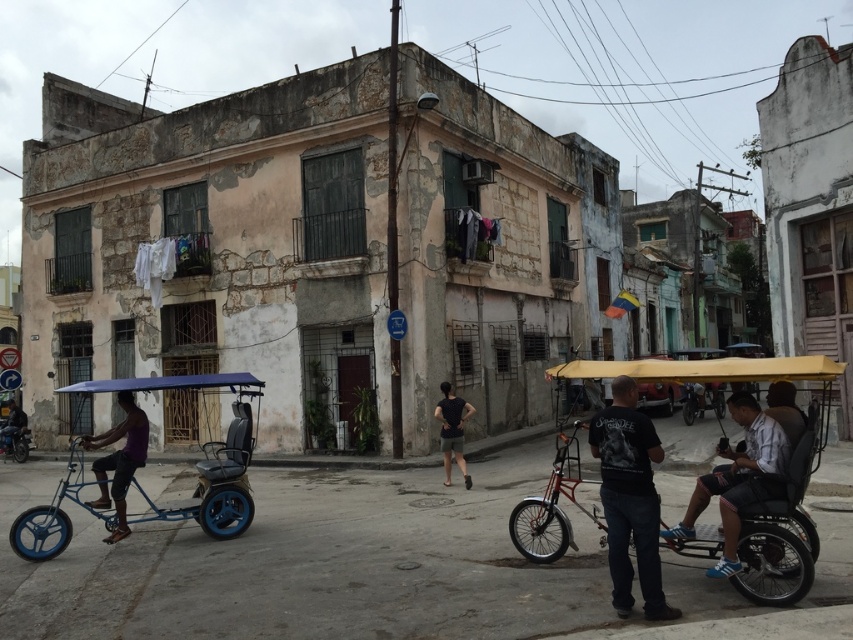
You are standing at the center of the street and see a shiny metallic bicycle at center. Can you tell me what object is located exactly at the coordinates point [553,506]?

The point [553,506] marks the shiny metallic bicycle at center.

You are a tourist standing on the street and see the purple fabric pedicab at left and the dark gray fabric pants at center. Which object is higher up in the scene?

The purple fabric pedicab at left is located above the dark gray fabric pants at center, so the purple fabric pedicab at left is higher up in the scene.

You are standing on the sidewalk and want to cross the street to reach the shiny metallic bicycle at center. If your walking speed is 1.5 meters per second, how many seconds will it take you to reach the bicycle?

The shiny metallic bicycle at center is 6.91 meters away from the viewer. At a walking speed of 1.5 meters per second, it would take approximately 4.6 seconds to reach the bicycle.